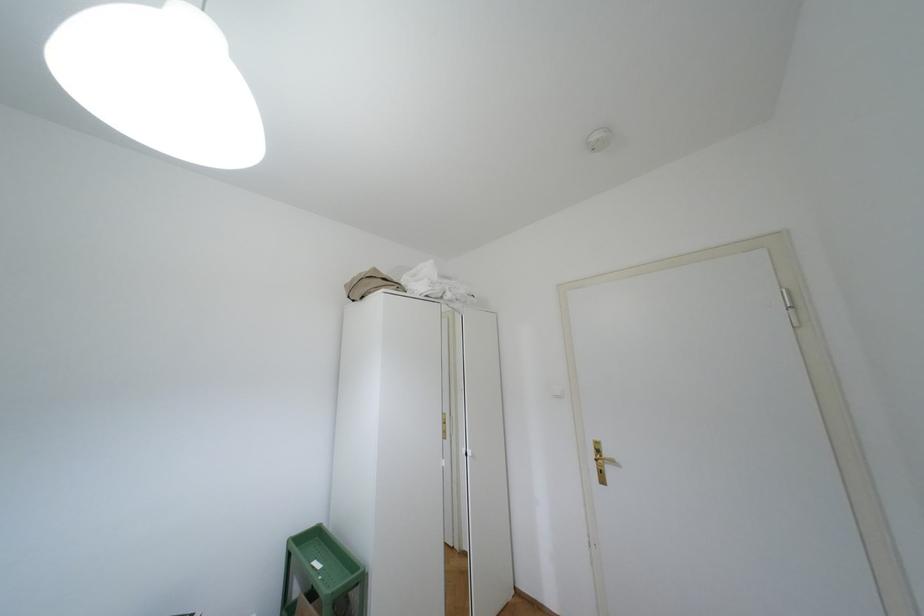
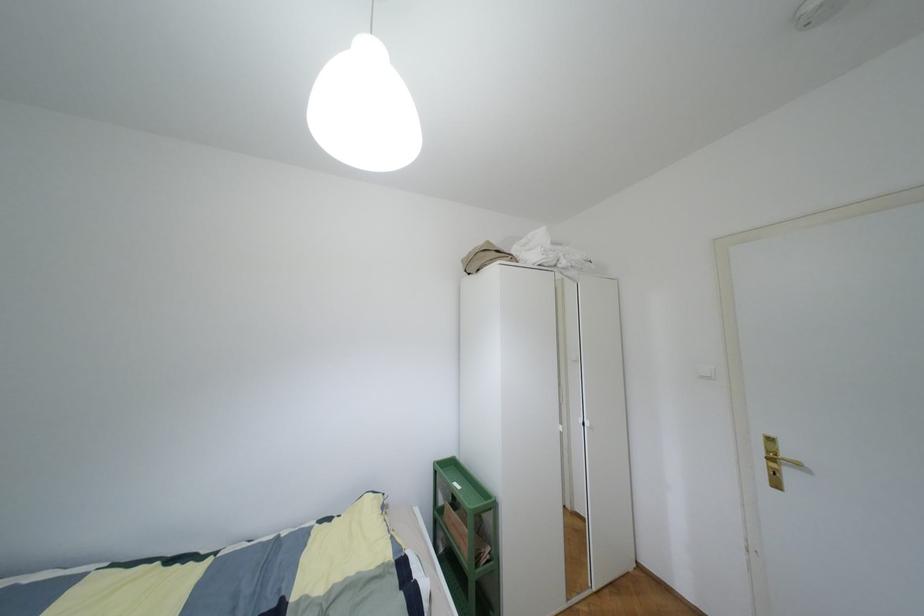
Question: Based on the continuous images, in which direction is the camera rotating? Reply with the corresponding letter.

Choices:
 (A) Left
 (B) Right
 (C) Up
 (D) Down

Answer: (A)